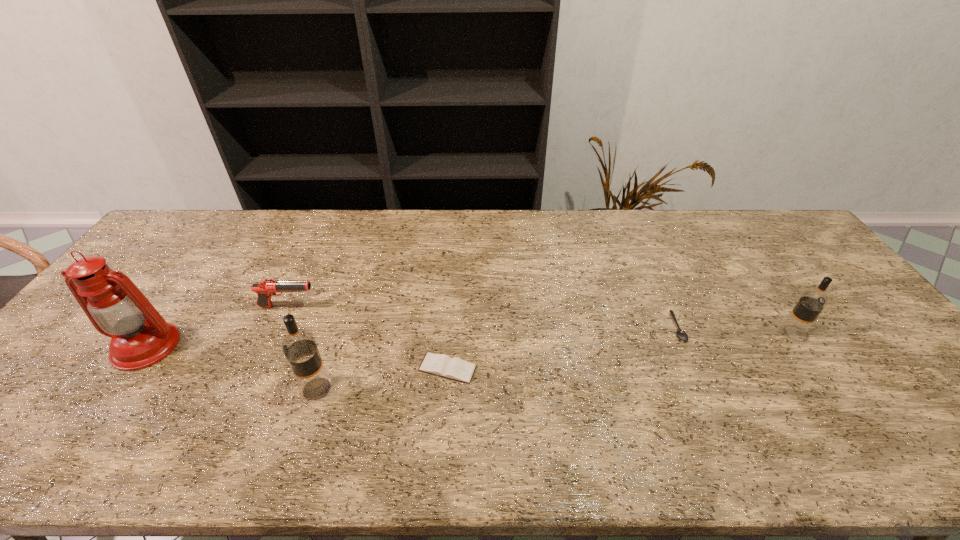
Identify the location of the left vodka. (300, 348).

Locate an element on the screen. This screenshot has height=540, width=960. the fourth object from right to left is located at coordinates (300, 348).

At what (x,y) coordinates should I click in order to perform the action: click on the rightmost object. Please return your answer as a coordinate pair (x, y). Looking at the image, I should click on (811, 303).

Identify the location of the shorter vodka. Image resolution: width=960 pixels, height=540 pixels. (811, 303).

Where is `the fifth object from right to left`? This screenshot has width=960, height=540. the fifth object from right to left is located at coordinates (266, 288).

Where is `gun`? Image resolution: width=960 pixels, height=540 pixels. gun is located at coordinates (266, 288).

Image resolution: width=960 pixels, height=540 pixels. What are the coordinates of `the tallest object` in the screenshot? It's located at (140, 337).

Locate an element on the screen. This screenshot has height=540, width=960. oil lamp is located at coordinates (140, 337).

Identify the location of the fifth object from left to right. (682, 335).

You are a GUI agent. You are given a task and a screenshot of the screen. Output one action in this format:
    pyautogui.click(x=<x>, y=<y>)
    Task: Click on the soupspoon
    The height and width of the screenshot is (540, 960).
    Given the screenshot: What is the action you would take?
    pyautogui.click(x=682, y=335)